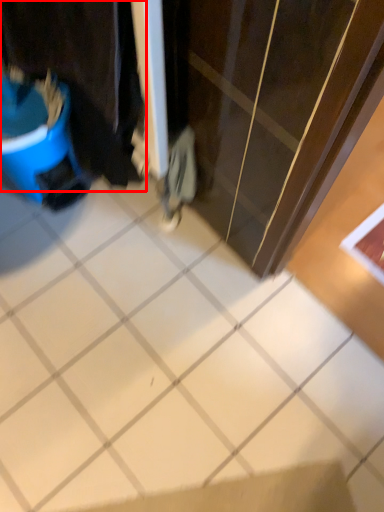
Question: From the image, what is the correct spatial relationship of laundry (annotated by the red box) in relation to ceramic tile?

Choices:
 (A) left
 (B) right

Answer: (A)